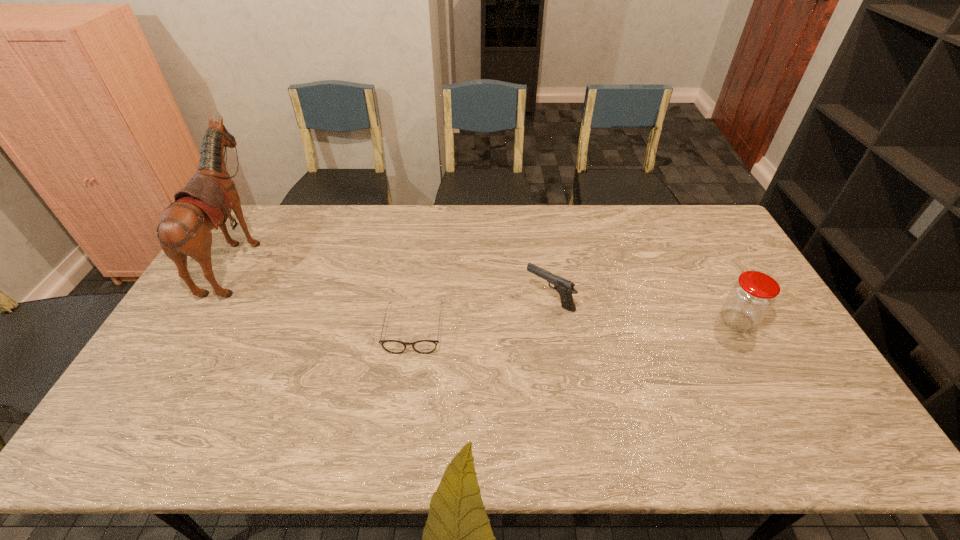
Where is `vacant space located 0.400m at the muzzle of the gun`? vacant space located 0.400m at the muzzle of the gun is located at coordinates (396, 299).

This screenshot has height=540, width=960. I want to click on vacant position located 0.180m at the muzzle of the gun, so pos(467,299).

I want to click on vacant space located at the muzzle of the gun, so click(490, 299).

Locate an element on the screen. Image resolution: width=960 pixels, height=540 pixels. vacant position located 0.230m through the lenses of the shortest object is located at coordinates (399, 435).

Find the location of `object situated at the far edge`. object situated at the far edge is located at coordinates (184, 229).

At what (x,y) coordinates should I click in order to perform the action: click on object that is at the left edge. Please return your answer as a coordinate pair (x, y). The height and width of the screenshot is (540, 960). Looking at the image, I should click on (184, 229).

Where is `object situated at the right edge`? object situated at the right edge is located at coordinates (751, 297).

I want to click on object that is positioned at the far left corner, so click(184, 229).

You are a GUI agent. You are given a task and a screenshot of the screen. Output one action in this format:
    pyautogui.click(x=<x>, y=<y>)
    Task: Click on the vacant space at the far edge of the desktop
    
    Given the screenshot: What is the action you would take?
    pyautogui.click(x=413, y=218)

Find the location of a particular element. This screenshot has width=960, height=540. free space at the near edge of the desktop is located at coordinates (x=233, y=428).